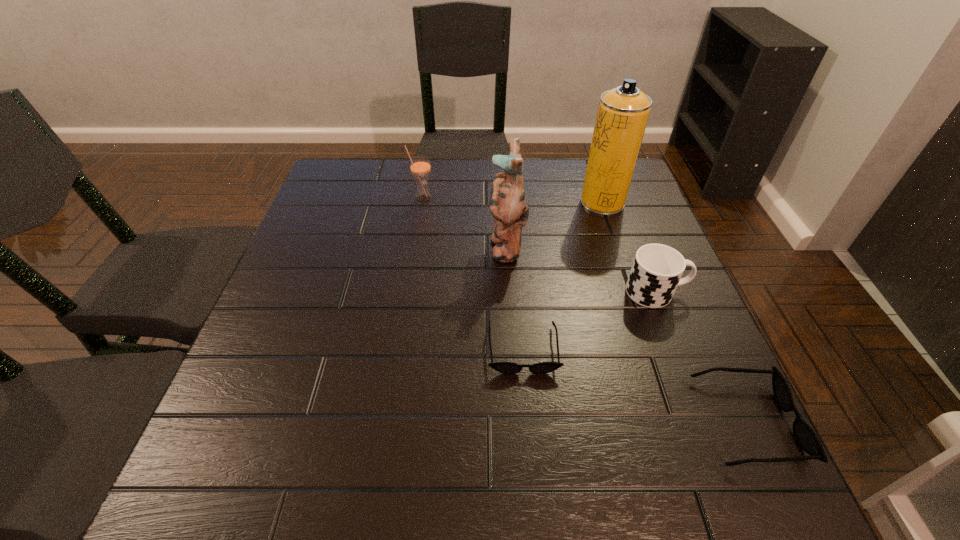
At what (x,y) coordinates should I click in order to perform the action: click on free space between the fourth tallest object and the fifth shortest object. Please return your answer as a coordinate pair (x, y). The width and height of the screenshot is (960, 540). Looking at the image, I should click on (581, 269).

The height and width of the screenshot is (540, 960). What are the coordinates of `empty location between the fourth farthest object and the second tallest object` in the screenshot? It's located at (581, 269).

Where is `free point between the fourth tallest object and the figurine`? Image resolution: width=960 pixels, height=540 pixels. free point between the fourth tallest object and the figurine is located at coordinates (581, 269).

Find the location of a particular element. vacant area that lies between the third nearest object and the tallest object is located at coordinates (629, 247).

The image size is (960, 540). What are the coordinates of `vacant area between the farther sunglasses and the third nearest object` in the screenshot? It's located at (589, 320).

What are the coordinates of `unoccupied position between the second nearest object and the cup` in the screenshot? It's located at (589, 320).

The height and width of the screenshot is (540, 960). I want to click on unoccupied area between the shorter sunglasses and the fourth shortest object, so click(x=472, y=274).

Where is `vacant point located between the fourth farthest object and the leftmost object`? Image resolution: width=960 pixels, height=540 pixels. vacant point located between the fourth farthest object and the leftmost object is located at coordinates (540, 246).

The height and width of the screenshot is (540, 960). What are the coordinates of `free space between the leftmost object and the shorter sunglasses` in the screenshot? It's located at (472, 274).

Select which object is the fifth closest to the tallest object. Please provide its 2D coordinates. Your answer should be formatted as a tuple, i.e. [(x, y)], where the tuple contains the x and y coordinates of a point satisfying the conditions above.

[(806, 437)]